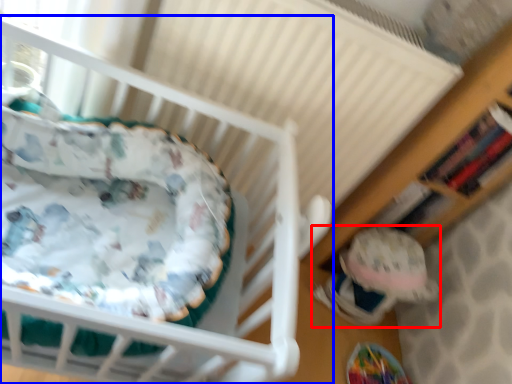
Question: Among these objects, which one is farthest to the camera, toy (highlighted by a red box) or infant bed (highlighted by a blue box)?

Choices:
 (A) toy
 (B) infant bed

Answer: (A)